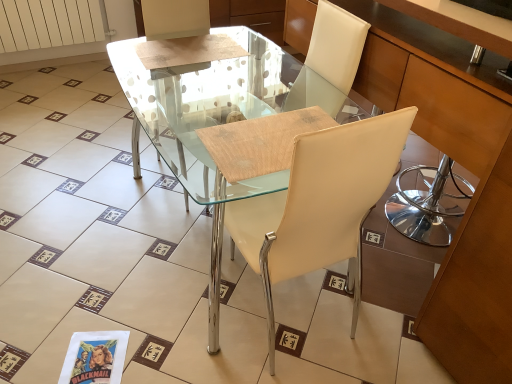
At what (x,y) coordinates should I click in order to perform the action: click on free region on the left part of matte white chair at center. Please return your answer as a coordinate pair (x, y). The image size is (512, 384). Looking at the image, I should click on (150, 321).